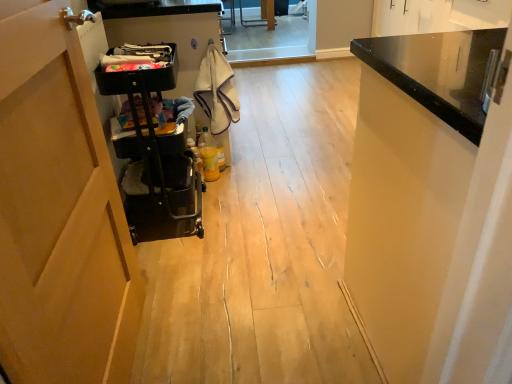
Where is `free spot to the right of black plastic trolley at left`? The width and height of the screenshot is (512, 384). free spot to the right of black plastic trolley at left is located at coordinates (241, 203).